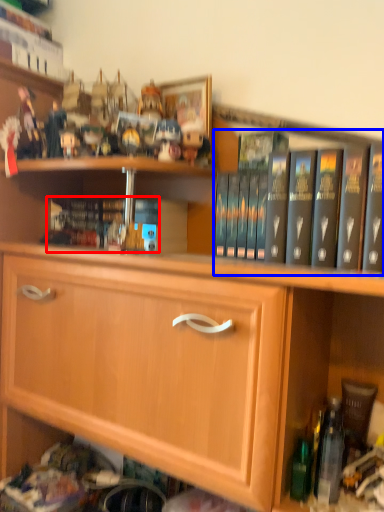
Question: Among these objects, which one is farthest to the camera, book (highlighted by a red box) or book (highlighted by a blue box)?

Choices:
 (A) book
 (B) book

Answer: (A)